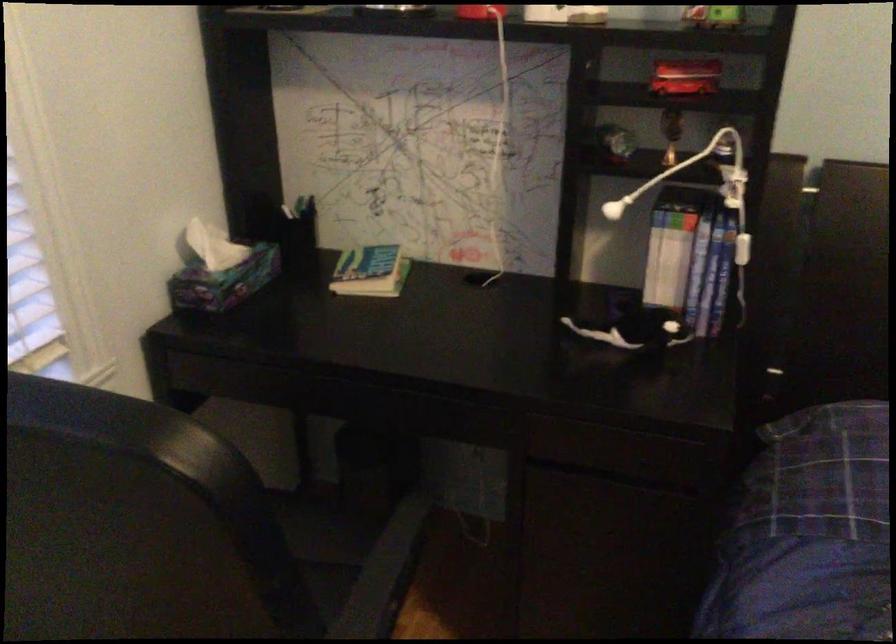
The image size is (896, 644). What are the coordinates of `chair armrest` in the screenshot? It's located at (399, 536).